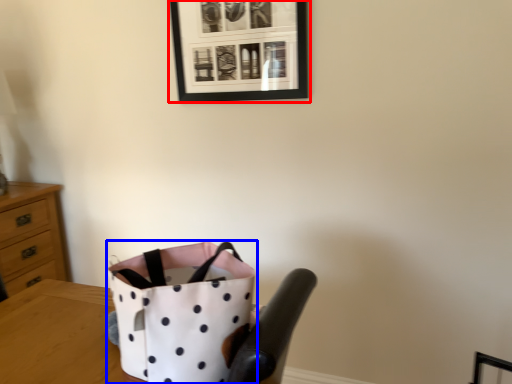
Question: Which object appears closest to the camera in this image, picture frame (highlighted by a red box) or handbag (highlighted by a blue box)?

Choices:
 (A) picture frame
 (B) handbag

Answer: (B)